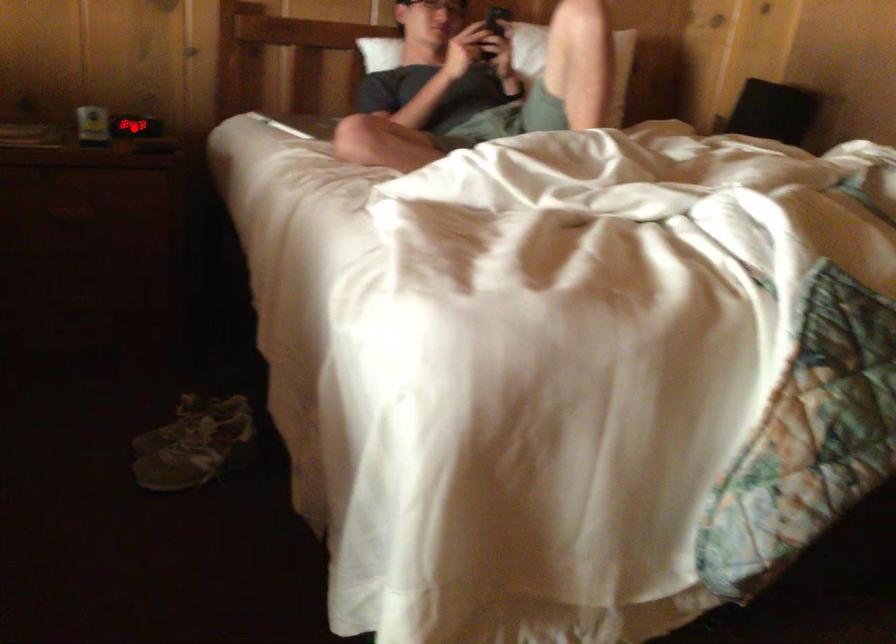
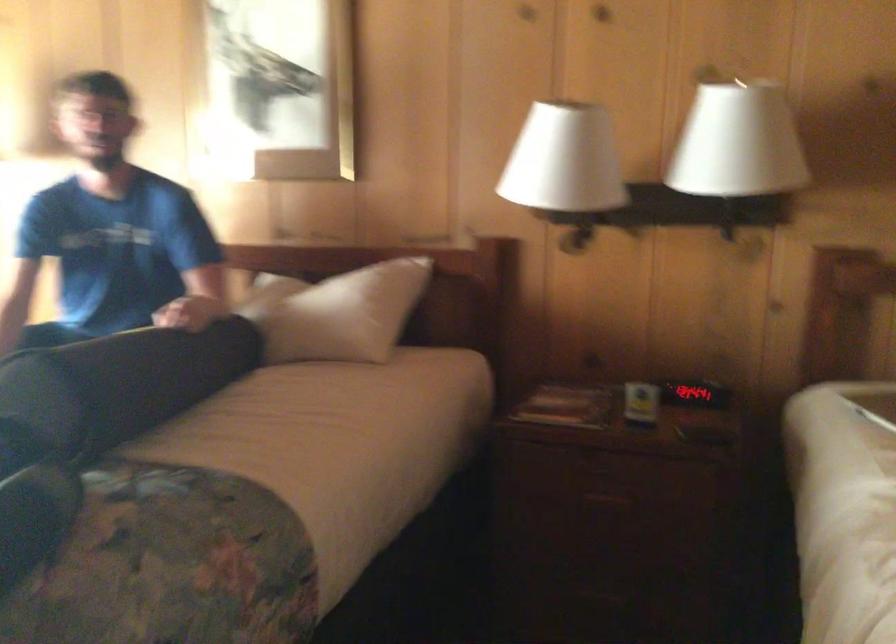
Question: I am providing you with two images of the same scene from different viewpoints. Given a red point in image1, look at the same physical point in image2. Is it:

Choices:
 (A) Closer to the viewpoint
 (B) Farther from the viewpoint

Answer: (A)